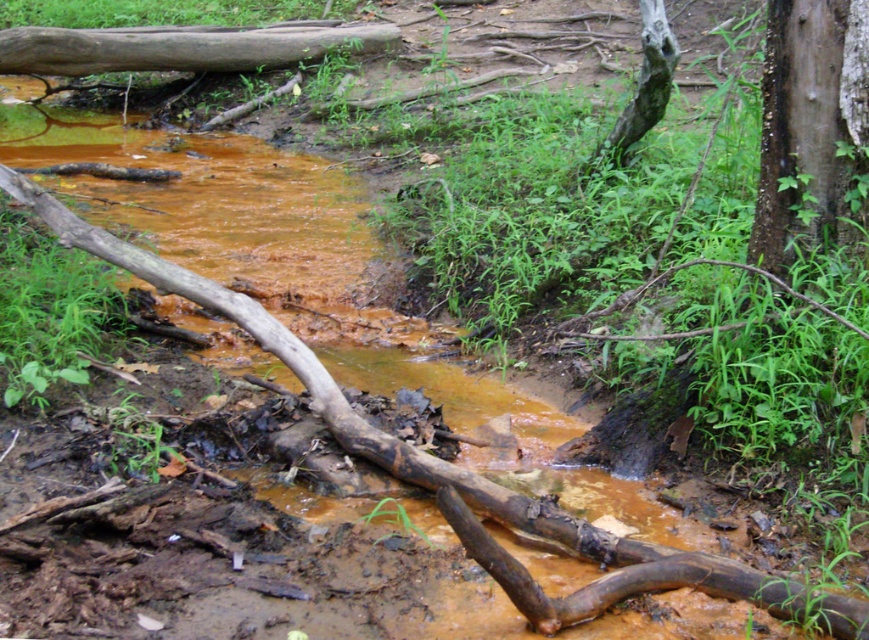
You are a hiker trying to identify two tree trunks in the distance. You see the green rough bark tree trunk at upper right and the gray rough tree trunk at upper right. Which one is narrower?

The green rough bark tree trunk at upper right is smaller than the gray rough tree trunk at upper right, so the green rough bark tree trunk at upper right is narrower.

You are a hiker carrying a backpack and need to cross the stream. You see a brown rough log at upper left and a gray rough tree trunk at upper right. Which one is closer to you if you are standing at the starting point on the bank?

The brown rough log at upper left is closer to you than the gray rough tree trunk at upper right because they are 13.53 feet apart, so the log is nearer.

Based on the photo, you are a hiker trying to cross the stream. You notice a brown rough log at upper left and a gray rough tree trunk at upper right. Which object is higher above the water level?

The brown rough log at upper left is much taller than the gray rough tree trunk at upper right, so the brown rough log at upper left is higher above the water level.